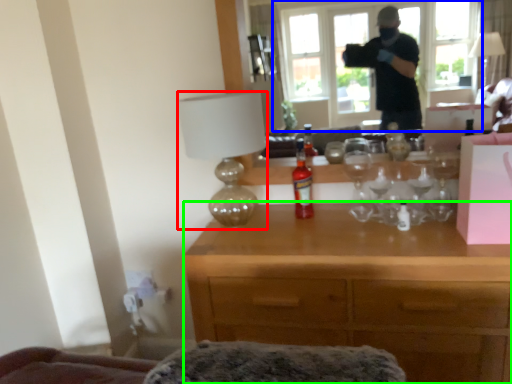
Question: Which is farther away from lamp (highlighted by a red box)? window (highlighted by a blue box) or desk (highlighted by a green box)?

Choices:
 (A) window
 (B) desk

Answer: (A)